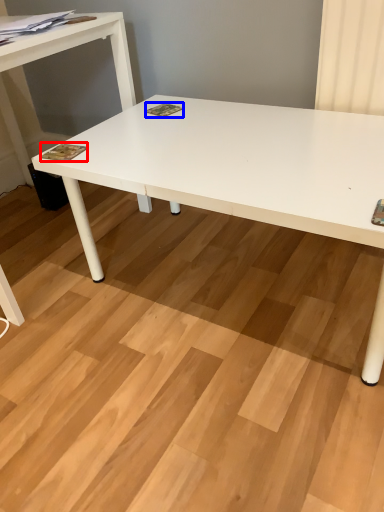
Question: Which object appears farthest to the camera in this image, magazine (highlighted by a red box) or magazine (highlighted by a blue box)?

Choices:
 (A) magazine
 (B) magazine

Answer: (B)